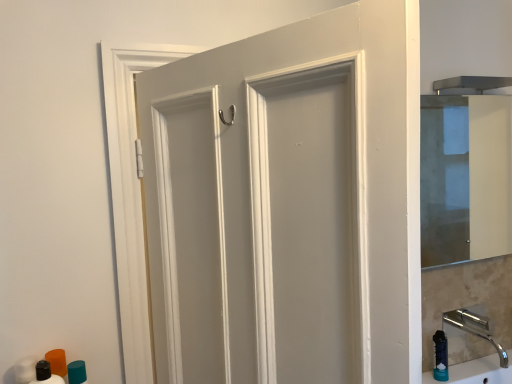
Question: Is teal matte cylinder at lower left, the 1th toiletry viewed from the back, wider than polished chrome faucet at lower right?

Choices:
 (A) no
 (B) yes

Answer: (A)

Question: Considering the relative sizes of teal matte cylinder at lower left, the 2th toiletry from the front, and polished chrome faucet at lower right in the image provided, is teal matte cylinder at lower left, the 2th toiletry from the front, shorter than polished chrome faucet at lower right?

Choices:
 (A) yes
 (B) no

Answer: (B)

Question: Would you consider teal matte cylinder at lower left, the 1th toiletry viewed from the back, to be distant from polished chrome faucet at lower right?

Choices:
 (A) yes
 (B) no

Answer: (A)

Question: Is teal matte cylinder at lower left, the 2th toiletry from the front, directly adjacent to polished chrome faucet at lower right?

Choices:
 (A) yes
 (B) no

Answer: (B)

Question: Can you confirm if teal matte cylinder at lower left, the 1th toiletry viewed from the back, is positioned to the left of polished chrome faucet at lower right?

Choices:
 (A) yes
 (B) no

Answer: (A)

Question: From a real-world perspective, is teal matte cylinder at lower left, the 1th toiletry viewed from the back, physically located above or below transparent glass cabinet at right?

Choices:
 (A) above
 (B) below

Answer: (B)

Question: Is point (71, 367) positioned closer to the camera than point (446, 107)?

Choices:
 (A) farther
 (B) closer

Answer: (B)

Question: In terms of size, does teal matte cylinder at lower left, the 1th toiletry viewed from the back, appear bigger or smaller than transparent glass cabinet at right?

Choices:
 (A) small
 (B) big

Answer: (A)

Question: Visually, is teal matte cylinder at lower left, the 1th toiletry viewed from the back, positioned to the left or to the right of transparent glass cabinet at right?

Choices:
 (A) left
 (B) right

Answer: (A)

Question: In terms of height, does matte black bottle at lower left, marked as the second toiletry in a back-to-front arrangement, look taller or shorter compared to polished chrome faucet at lower right?

Choices:
 (A) tall
 (B) short

Answer: (A)

Question: In terms of width, does matte black bottle at lower left, the first toiletry when ordered from front to back, look wider or thinner when compared to polished chrome faucet at lower right?

Choices:
 (A) wide
 (B) thin

Answer: (B)

Question: From the image's perspective, relative to polished chrome faucet at lower right, is matte black bottle at lower left, the first toiletry when ordered from front to back, above or below?

Choices:
 (A) below
 (B) above

Answer: (A)

Question: Is matte black bottle at lower left, marked as the second toiletry in a back-to-front arrangement, in front of or behind polished chrome faucet at lower right in the image?

Choices:
 (A) front
 (B) behind

Answer: (A)

Question: Is teal matte cylinder at lower left, the 1th toiletry viewed from the back, bigger or smaller than matte white door at center?

Choices:
 (A) big
 (B) small

Answer: (B)

Question: From the image's perspective, is teal matte cylinder at lower left, the 2th toiletry from the front, positioned above or below matte white door at center?

Choices:
 (A) above
 (B) below

Answer: (B)